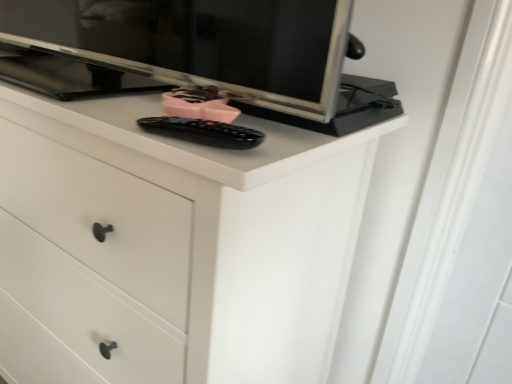
The width and height of the screenshot is (512, 384). Find the location of `vacant area situated to the left side of black plastic remote at center`. vacant area situated to the left side of black plastic remote at center is located at coordinates (117, 112).